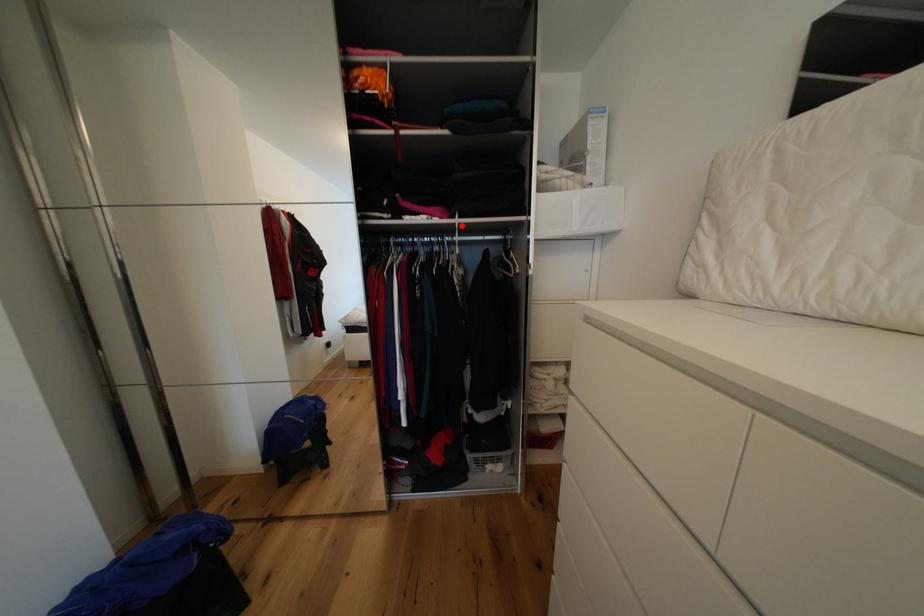
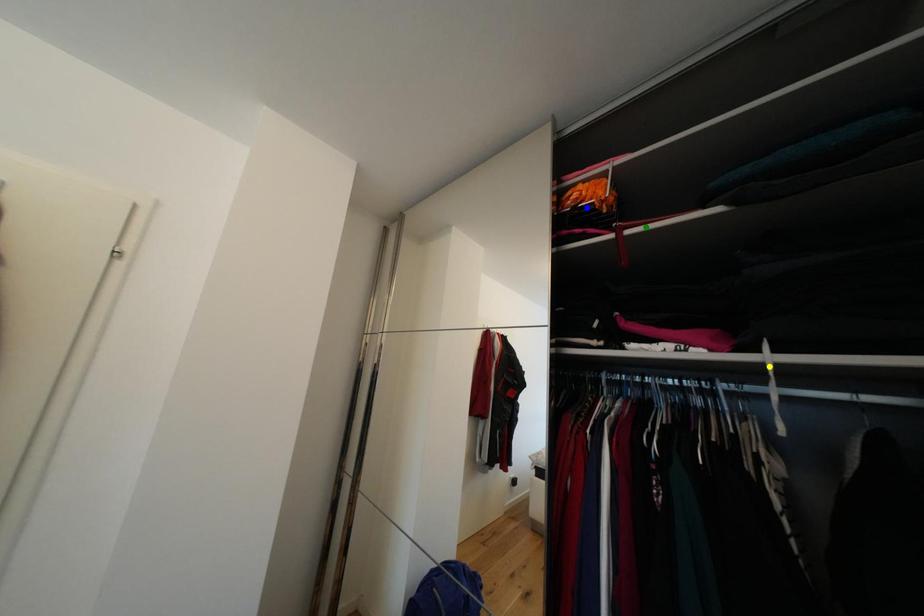
Question: I am providing you with two images of the same scene from different viewpoints. A red point is marked on the first image. You are given multiple points on the second image. Can you choose the point in image 2 that corresponds to the point in image 1?

Choices:
 (A) green point
 (B) blue point
 (C) yellow point

Answer: (C)